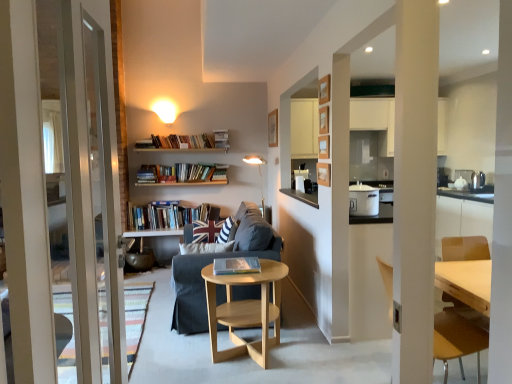
Find the location of a particular element. light brown wooden chair at right is located at coordinates (457, 340).

The height and width of the screenshot is (384, 512). Describe the element at coordinates (236, 265) in the screenshot. I see `hardcover book at center, which is the second book in left-to-right order` at that location.

The height and width of the screenshot is (384, 512). Find the location of `striped fabric pillow at center`. striped fabric pillow at center is located at coordinates [227, 230].

At what (x,y) coordinates should I click in order to perform the action: click on white glossy pot at center-right, the second appliance viewed from the back. Please return your answer as a coordinate pair (x, y). This screenshot has height=384, width=512. Looking at the image, I should click on (362, 200).

The image size is (512, 384). I want to click on metallic silver kettle at right, the second appliance in the left-to-right sequence, so click(x=477, y=180).

Looking at this image, does light wood/woodenobject at center turn towards striped fabric pillow at center?

No, light wood/woodenobject at center is not aimed at striped fabric pillow at center.

Based on the photo, is light wood/woodenobject at center thinner than striped fabric pillow at center?

No, light wood/woodenobject at center is not thinner than striped fabric pillow at center.

Is light wood/woodenobject at center in contact with striped fabric pillow at center?

There is a gap between light wood/woodenobject at center and striped fabric pillow at center.

Is light brown wooden chair at right inside or outside of hardcover books at center, placed as the second book when sorted from front to back?

light brown wooden chair at right is located beyond the bounds of hardcover books at center, placed as the second book when sorted from front to back.

Between light brown wooden chair at right and hardcover books at center, marked as the 1th book in a back-to-front arrangement, which one has smaller size?

With smaller size is hardcover books at center, marked as the 1th book in a back-to-front arrangement.

From the image's perspective, would you say light brown wooden chair at right is positioned over hardcover books at center, which is the 1th book in top-to-bottom order?

No, from the image's perspective, light brown wooden chair at right is not above hardcover books at center, which is the 1th book in top-to-bottom order.

Which is more to the left, light brown wooden chair at right or striped fabric pillow at center?

From the viewer's perspective, striped fabric pillow at center appears more on the left side.

From a real-world perspective, which is physically below, light brown wooden chair at right or striped fabric pillow at center?

light brown wooden chair at right, from a real-world perspective.

Between light brown wooden chair at right and striped fabric pillow at center, which one is positioned in front?

Positioned in front is light brown wooden chair at right.

From the image's perspective, is light brown wooden chair at right under striped fabric pillow at center?

Yes, from the image's perspective, light brown wooden chair at right is below striped fabric pillow at center.

Is striped fabric pillow at center not close to light wood/woodenobject at center?

No, striped fabric pillow at center is not far from light wood/woodenobject at center.

Considering the sizes of objects striped fabric pillow at center and light wood/woodenobject at center in the image provided, who is wider, striped fabric pillow at center or light wood/woodenobject at center?

light wood/woodenobject at center.

Is striped fabric pillow at center shorter than light wood/woodenobject at center?

Indeed, striped fabric pillow at center has a lesser height compared to light wood/woodenobject at center.

Would you say striped fabric pillow at center is to the left or to the right of light wood/woodenobject at center in the picture?

Based on their positions, striped fabric pillow at center is located to the left of light wood/woodenobject at center.

From the image's perspective, who appears lower, white glossy pot at center-right, marked as the 1th appliance in a left-to-right arrangement, or light wood/woodenobject at center?

light wood/woodenobject at center is shown below in the image.

From a real-world perspective, between white glossy pot at center-right, marked as the 1th appliance in a left-to-right arrangement, and light wood/woodenobject at center, who is vertically lower?

light wood/woodenobject at center is physically lower.

Looking at this image, is white glossy pot at center-right, arranged as the 2th appliance when viewed from the right, situated inside light wood/woodenobject at center or outside?

white glossy pot at center-right, arranged as the 2th appliance when viewed from the right, is outside light wood/woodenobject at center.

Does metallic silver kettle at right, arranged as the 2th appliance when viewed from the front, have a lesser height compared to light wood/woodenobject at center?

Indeed, metallic silver kettle at right, arranged as the 2th appliance when viewed from the front, has a lesser height compared to light wood/woodenobject at center.

The height and width of the screenshot is (384, 512). In order to click on the 2nd appliance above the light wood/woodenobject at center (from the image's perspective) in this screenshot , I will do `click(477, 180)`.

Is light wood/woodenobject at center in contact with dark gray fabric couch at center?

No, light wood/woodenobject at center is not making contact with dark gray fabric couch at center.

Considering the relative positions of light wood/woodenobject at center and dark gray fabric couch at center in the image provided, is light wood/woodenobject at center to the right of dark gray fabric couch at center from the viewer's perspective?

Yes, light wood/woodenobject at center is to the right of dark gray fabric couch at center.

Locate an element on the screen. Image resolution: width=512 pixels, height=384 pixels. table on the right of striped fabric pillow at center is located at coordinates (245, 311).

The height and width of the screenshot is (384, 512). I want to click on book that is the 2nd object located above the light brown wooden chair at right (from the image's perspective), so click(x=169, y=216).

Estimate the real-world distances between objects in this image. Which object is closer to light brown wooden chair at right, light wood/woodenobject at center or dark gray fabric couch at center?

light wood/woodenobject at center lies closer to light brown wooden chair at right than the other object.

Based on their spatial positions, is white glossy pot at center-right, marked as the 1th appliance in a left-to-right arrangement, or gold metallic floor lamp at center closer to dark gray fabric couch at center?

white glossy pot at center-right, marked as the 1th appliance in a left-to-right arrangement.

Estimate the real-world distances between objects in this image. Which object is closer to metallic silver kettle at right, placed as the 1th appliance when sorted from right to left, dark gray fabric couch at center or light brown wooden chair at right?

The object closer to metallic silver kettle at right, placed as the 1th appliance when sorted from right to left, is light brown wooden chair at right.

Which object lies further to the anchor point dark gray fabric couch at center, hardcover book at center, which ranks as the first book in bottom-to-top order, or metallic silver kettle at right, the second appliance in the left-to-right sequence?

metallic silver kettle at right, the second appliance in the left-to-right sequence, is further to dark gray fabric couch at center.

Considering their positions, is dark gray fabric couch at center positioned further to light wood/woodenobject at center than hardcover books at center, placed as the first book when sorted from left to right?

hardcover books at center, placed as the first book when sorted from left to right, lies further to light wood/woodenobject at center than the other object.

Considering their positions, is metallic silver kettle at right, the first appliance when ordered from back to front, positioned closer to striped fabric pillow at center than light brown wooden chair at right?

light brown wooden chair at right lies closer to striped fabric pillow at center than the other object.

From the image, which object appears to be farther from light wood/woodenobject at center, metallic silver kettle at right, arranged as the 2th appliance when viewed from the front, or light brown wooden chair at right?

Among the two, metallic silver kettle at right, arranged as the 2th appliance when viewed from the front, is located further to light wood/woodenobject at center.

When comparing their distances from dark gray fabric couch at center, does gold metallic floor lamp at center or striped fabric pillow at center seem closer?

The object closer to dark gray fabric couch at center is striped fabric pillow at center.

Where is `pillow between dark gray fabric couch at center and gold metallic floor lamp at center from front to back`? This screenshot has width=512, height=384. pillow between dark gray fabric couch at center and gold metallic floor lamp at center from front to back is located at coordinates (227, 230).

Image resolution: width=512 pixels, height=384 pixels. I want to click on studio couch positioned between hardcover book at center, marked as the 2th book in a top-to-bottom arrangement, and hardcover books at center, the second book in the right-to-left sequence, from near to far, so click(x=204, y=284).

The width and height of the screenshot is (512, 384). I want to click on studio couch located between light brown wooden chair at right and gold metallic floor lamp at center in the depth direction, so click(204, 284).

Locate an element on the screen. table between hardcover books at center, placed as the 2th book when sorted from bottom to top, and metallic silver kettle at right, arranged as the 2th appliance when viewed from the front, from left to right is located at coordinates (245, 311).